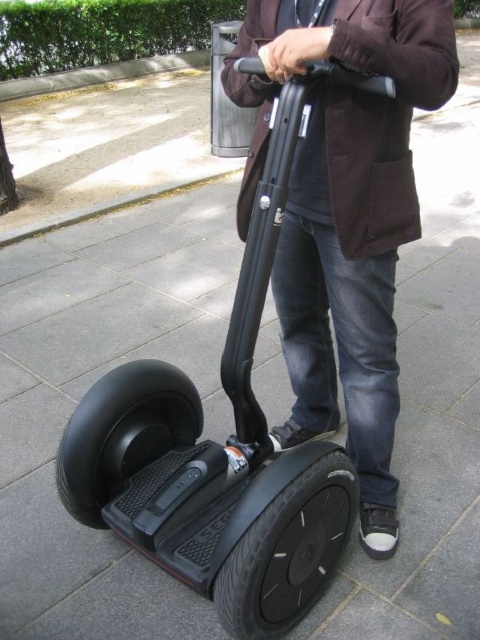
Question: Does dark brown leather jacket at center appear under black rubber scooter at center?

Choices:
 (A) no
 (B) yes

Answer: (A)

Question: Which object appears closest to the camera in this image?

Choices:
 (A) black rubber scooter at center
 (B) dark brown leather jacket at center

Answer: (B)

Question: Can you confirm if dark brown leather jacket at center is positioned to the right of black rubber scooter at center?

Choices:
 (A) yes
 (B) no

Answer: (A)

Question: Can you confirm if dark brown leather jacket at center is positioned to the left of black rubber scooter at center?

Choices:
 (A) yes
 (B) no

Answer: (B)

Question: Which of the following is the farthest from the observer?

Choices:
 (A) (244, 310)
 (B) (360, 10)

Answer: (A)